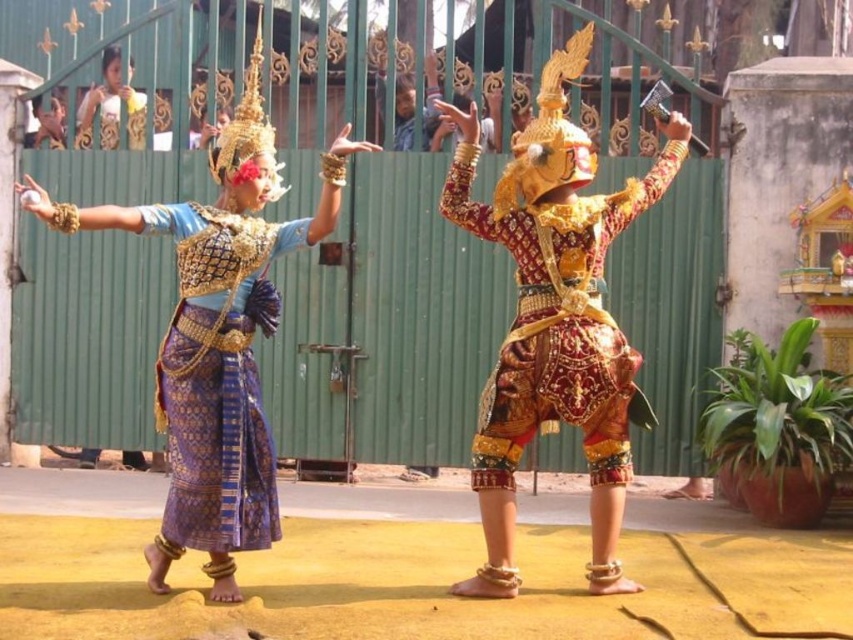
You are a photographer positioned in front of the performers. You want to capture a photo where both the gold textured fabric costume at center and the blue silk skirt at left are clearly visible. Considering their positions, which performer should be moved forward to ensure both are in frame without overlapping?

The blue silk skirt at left is currently behind the gold textured fabric costume at center. To ensure both are visible without overlapping, the gold textured fabric costume at center should be moved forward so that the blue silk skirt at left can be seen behind it.

You are a photographer positioned at the center of the courtyard. You want to capture a closeup shot of the gold textured fabric costume at center. Based on its position coordinates, is it within your camera frame which has a vertical field of view from 0.5 to 0.8 on the y axis?

The gold textured fabric costume at center is positioned at y coordinate 0.655, which falls within the camera frame vertical field of view from 0.5 to 0.8 on the y axis. Therefore, it is within the frame.

You are a photographer taking pictures of the performers. You want to capture both the gold textured fabric costume at center and the blue silk skirt at left in a single frame. Which performer should you position closer to the center of your camera viewfinder to ensure both are visible?

The gold textured fabric costume at center is to the right of the blue silk skirt at left. To ensure both are visible in the frame, position the blue silk skirt at left closer to the center of your camera viewfinder since it is already on the left side and the gold textured fabric costume at center is positioned to its right.